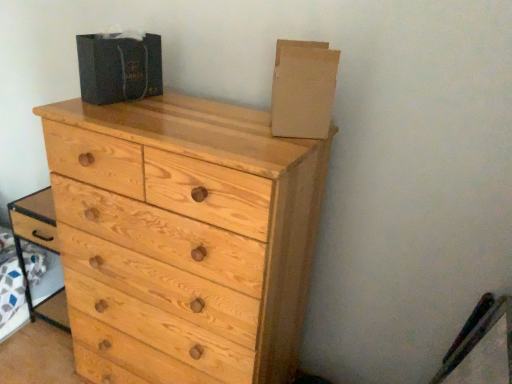
Question: Is cardboard at upper right, which is counted as the 1th cardboard box, starting from the right, in front of dark gray cardboard box at upper center, which is counted as the second cardboard box, starting from the right?

Choices:
 (A) no
 (B) yes

Answer: (B)

Question: Are cardboard at upper right, placed as the 2th cardboard box when sorted from left to right, and dark gray cardboard box at upper center, which is counted as the second cardboard box, starting from the right, making contact?

Choices:
 (A) no
 (B) yes

Answer: (A)

Question: Is cardboard at upper right, placed as the 2th cardboard box when sorted from left to right, shorter than dark gray cardboard box at upper center, positioned as the 1th cardboard box in left-to-right order?

Choices:
 (A) yes
 (B) no

Answer: (B)

Question: Is cardboard at upper right, which is counted as the 1th cardboard box, starting from the right, at the left side of dark gray cardboard box at upper center, positioned as the 1th cardboard box in left-to-right order?

Choices:
 (A) yes
 (B) no

Answer: (B)

Question: Is the depth of cardboard at upper right, which is counted as the 1th cardboard box, starting from the right, greater than that of dark gray cardboard box at upper center, which is counted as the second cardboard box, starting from the right?

Choices:
 (A) no
 (B) yes

Answer: (A)

Question: Is cardboard at upper right, which is counted as the 1th cardboard box, starting from the right, situated inside light wood chest of drawers at center or outside?

Choices:
 (A) outside
 (B) inside

Answer: (A)

Question: From the image's perspective, relative to light wood chest of drawers at center, is cardboard at upper right, placed as the 2th cardboard box when sorted from left to right, above or below?

Choices:
 (A) above
 (B) below

Answer: (A)

Question: Is cardboard at upper right, which is counted as the 1th cardboard box, starting from the right, bigger or smaller than light wood chest of drawers at center?

Choices:
 (A) big
 (B) small

Answer: (B)

Question: In terms of height, does cardboard at upper right, placed as the 2th cardboard box when sorted from left to right, look taller or shorter compared to light wood chest of drawers at center?

Choices:
 (A) short
 (B) tall

Answer: (A)

Question: From a real-world perspective, is cardboard at upper right, which is counted as the 1th cardboard box, starting from the right, above or below dark gray cardboard box at upper center, positioned as the 1th cardboard box in left-to-right order?

Choices:
 (A) below
 (B) above

Answer: (B)

Question: In terms of size, does cardboard at upper right, placed as the 2th cardboard box when sorted from left to right, appear bigger or smaller than dark gray cardboard box at upper center, which is counted as the second cardboard box, starting from the right?

Choices:
 (A) small
 (B) big

Answer: (A)

Question: Considering the positions of point (288, 130) and point (91, 61), is point (288, 130) closer or farther from the camera than point (91, 61)?

Choices:
 (A) closer
 (B) farther

Answer: (A)

Question: Relative to dark gray cardboard box at upper center, positioned as the 1th cardboard box in left-to-right order, is cardboard at upper right, placed as the 2th cardboard box when sorted from left to right, in front or behind?

Choices:
 (A) front
 (B) behind

Answer: (A)

Question: Considering the positions of dark gray cardboard box at upper center, positioned as the 1th cardboard box in left-to-right order, and cardboard at upper right, placed as the 2th cardboard box when sorted from left to right, in the image, is dark gray cardboard box at upper center, positioned as the 1th cardboard box in left-to-right order, wider or thinner than cardboard at upper right, placed as the 2th cardboard box when sorted from left to right,?

Choices:
 (A) thin
 (B) wide

Answer: (B)

Question: From a real-world perspective, is dark gray cardboard box at upper center, positioned as the 1th cardboard box in left-to-right order, above or below cardboard at upper right, which is counted as the 1th cardboard box, starting from the right?

Choices:
 (A) below
 (B) above

Answer: (A)